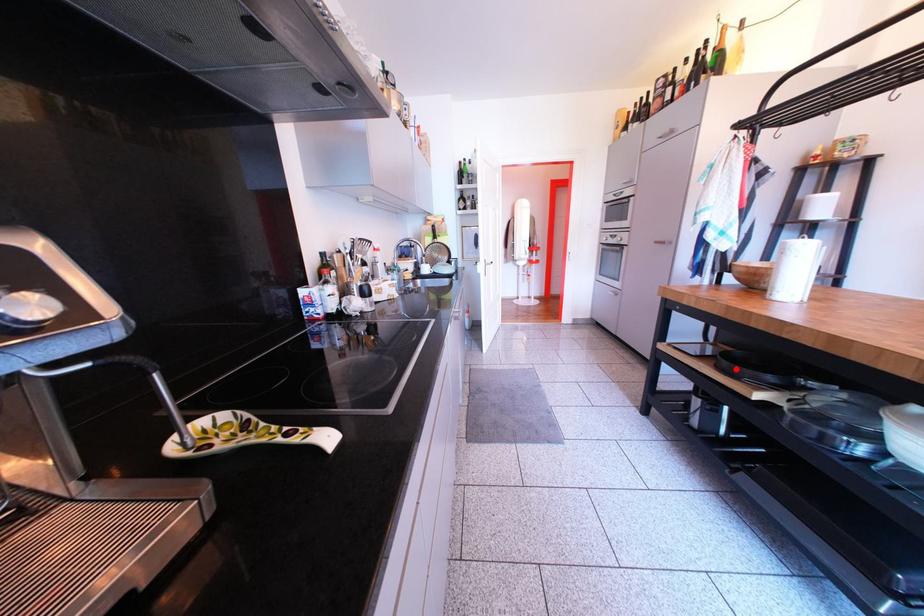
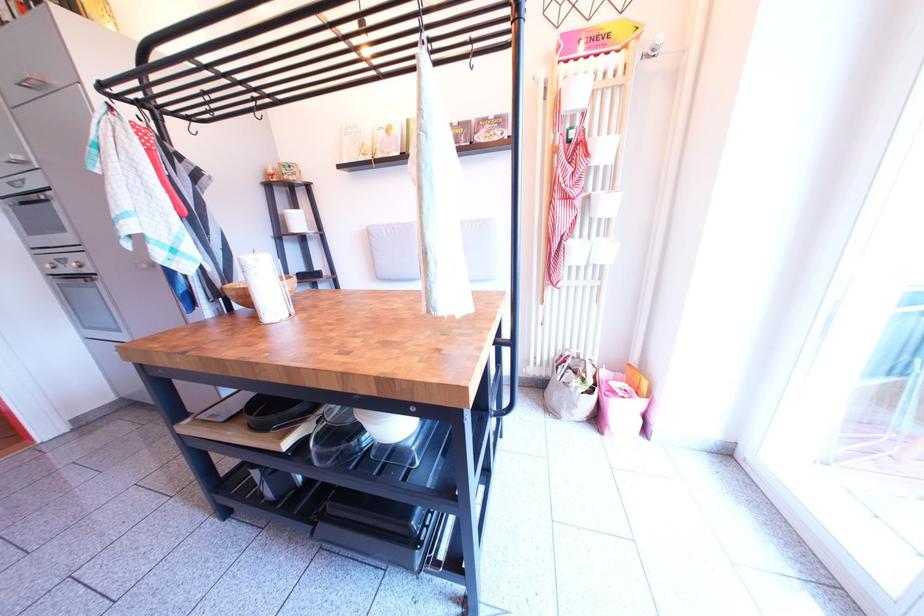
Locate, in the second image, the point that corresponds to the highlighted location in the first image.

(263, 423)